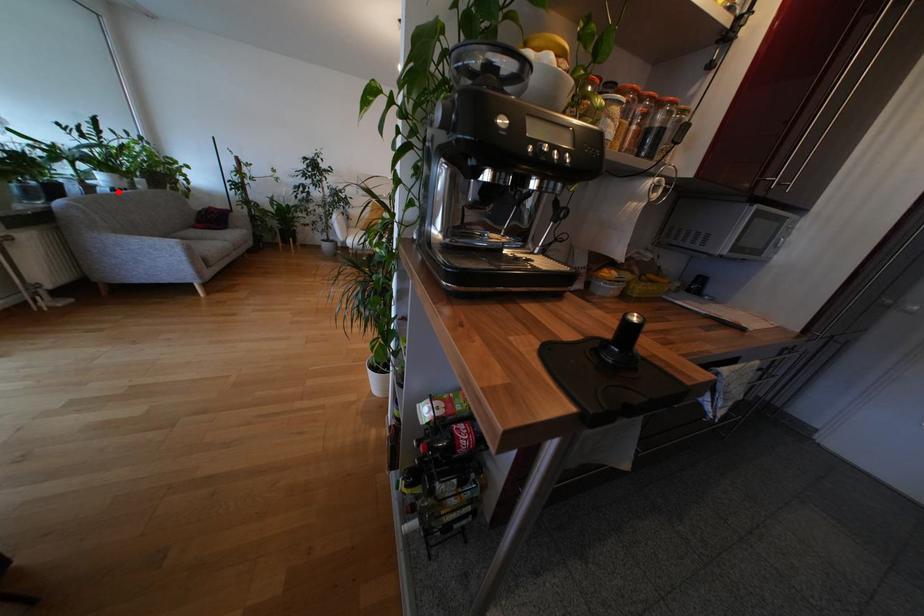
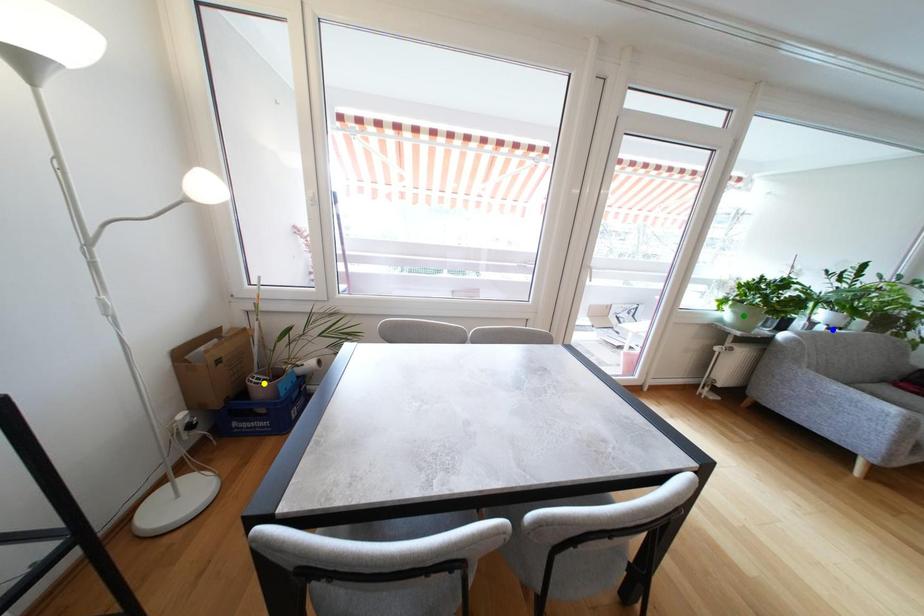
Question: I am providing you with two images of the same scene from different viewpoints. A red point is marked on the first image. You are given multiple points on the second image. In image 2, which mark is for the same physical point as the one in image 1?

Choices:
 (A) green point
 (B) yellow point
 (C) blue point

Answer: (C)